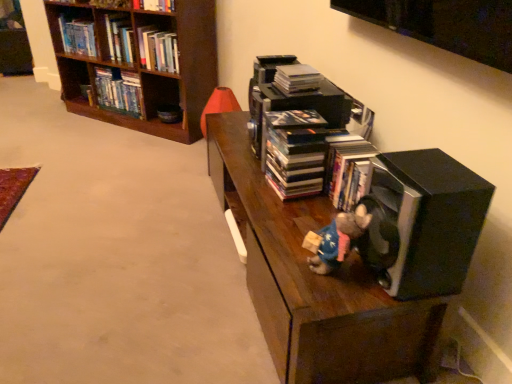
Question: Is dark wood shelf at center completely or partially inside brown wooden bookcase at upper left?

Choices:
 (A) no
 (B) yes

Answer: (A)

Question: Does brown wooden bookcase at upper left lie in front of dark wood shelf at center?

Choices:
 (A) no
 (B) yes

Answer: (A)

Question: Can you confirm if brown wooden bookcase at upper left is positioned to the right of dark wood shelf at center?

Choices:
 (A) no
 (B) yes

Answer: (A)

Question: Can you confirm if brown wooden bookcase at upper left is shorter than dark wood shelf at center?

Choices:
 (A) yes
 (B) no

Answer: (B)

Question: Is brown wooden bookcase at upper left not inside dark wood shelf at center?

Choices:
 (A) yes
 (B) no

Answer: (A)

Question: Does brown wooden bookcase at upper left have a greater width compared to dark wood shelf at center?

Choices:
 (A) yes
 (B) no

Answer: (B)

Question: Considering the relative positions of black matte speaker at lower right and black matte book at center, the first book from the front, in the image provided, is black matte speaker at lower right to the right of black matte book at center, the first book from the front, from the viewer's perspective?

Choices:
 (A) no
 (B) yes

Answer: (B)

Question: From the image's perspective, does black matte speaker at lower right appear higher than black matte book at center, which is the 4th book in back-to-front order?

Choices:
 (A) no
 (B) yes

Answer: (A)

Question: Is black matte speaker at lower right positioned far away from black matte book at center, which appears as the first book when viewed from the right?

Choices:
 (A) yes
 (B) no

Answer: (B)

Question: From a real-world perspective, does black matte speaker at lower right stand above black matte book at center, positioned as the 4th book in top-to-bottom order?

Choices:
 (A) yes
 (B) no

Answer: (A)

Question: From a real-world perspective, is black matte speaker at lower right positioned under black matte book at center, positioned as the 4th book in top-to-bottom order, based on gravity?

Choices:
 (A) no
 (B) yes

Answer: (A)

Question: Could black matte book at center, the first book from the bottom, be considered to be inside black matte speaker at lower right?

Choices:
 (A) yes
 (B) no

Answer: (B)

Question: Considering the relative positions of hardcover book at upper left, which ranks as the 1th book in top-to-bottom order, and dark wood shelf at center in the image provided, is hardcover book at upper left, which ranks as the 1th book in top-to-bottom order, to the left of dark wood shelf at center from the viewer's perspective?

Choices:
 (A) yes
 (B) no

Answer: (A)